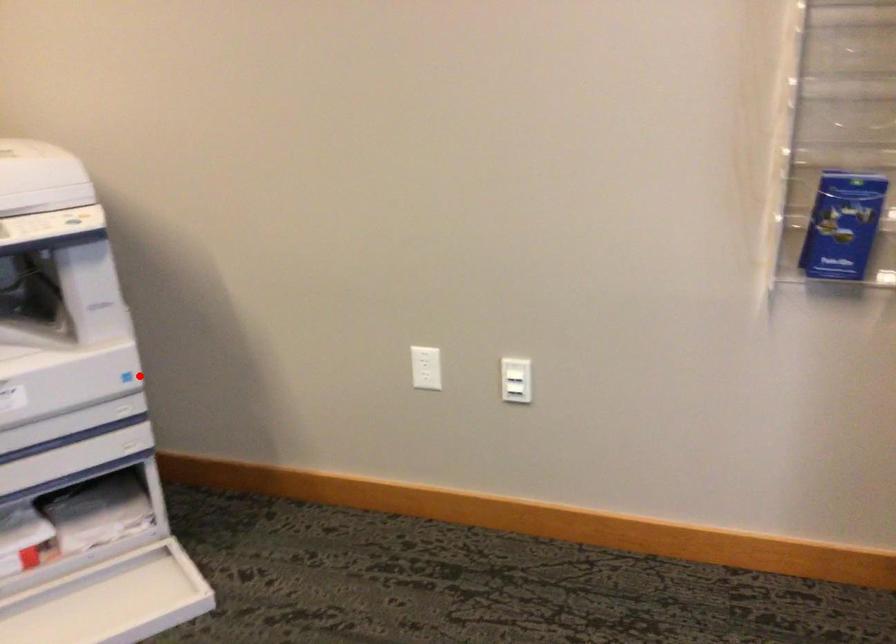
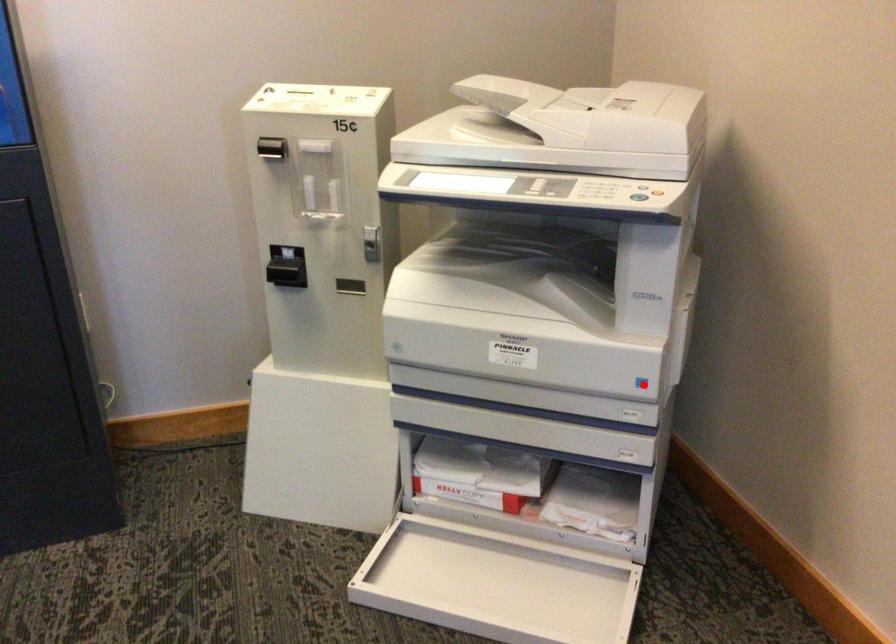
I am providing you with two images of the same scene from different viewpoints. A red point is marked on the first image and another point is marked on the second image. Does the point marked in image1 correspond to the same location as the one in image2?

Yes